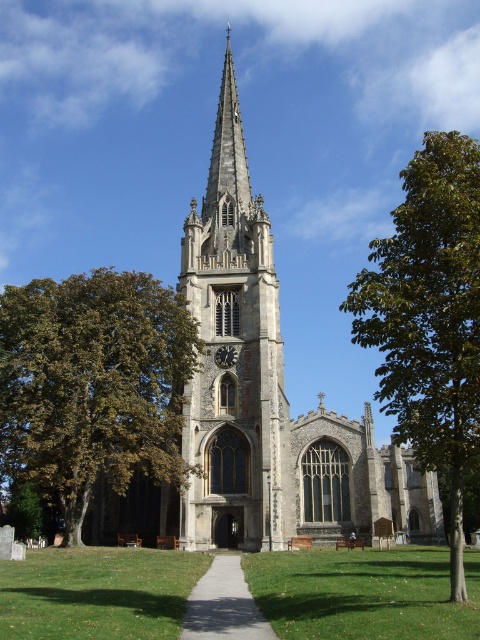
Question: From the image, what is the correct spatial relationship of green leafy tree at center in relation to gravel pathway at center?

Choices:
 (A) above
 (B) below

Answer: (A)

Question: Among these points, which one is nearest to the camera?

Choices:
 (A) (230, 358)
 (B) (275, 358)
 (C) (465, 152)
 (D) (10, 488)

Answer: (C)

Question: Observing the image, what is the correct spatial positioning of gravel pathway at center in reference to green leafy tree at lower left?

Choices:
 (A) right
 (B) left

Answer: (A)

Question: Which object is positioned closest to the smooth stone tower at center?

Choices:
 (A) gravel pathway at center
 (B) green leafy tree at right
 (C) stone church steeple at center
 (D) metallic clock face at center

Answer: (C)

Question: Is gravel pathway at center in front of green leafy tree at lower left?

Choices:
 (A) yes
 (B) no

Answer: (A)

Question: Among these points, which one is farthest from the camera?

Choices:
 (A) (39, 476)
 (B) (252, 196)
 (C) (228, 579)

Answer: (B)